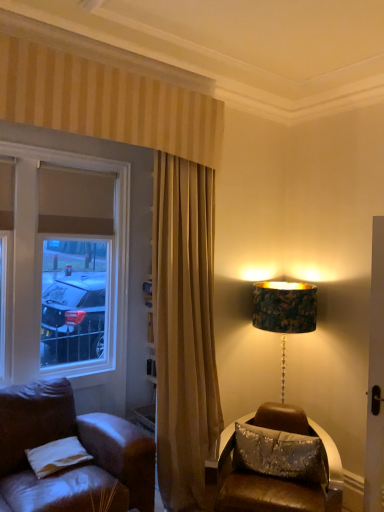
Question: From a real-world perspective, is white fabric pillow at lower left, the 2th pillow in the right-to-left sequence, below matte glass window at left?

Choices:
 (A) yes
 (B) no

Answer: (A)

Question: Is white fabric pillow at lower left, arranged as the first pillow when viewed from the left, with matte glass window at left?

Choices:
 (A) yes
 (B) no

Answer: (B)

Question: From the image's perspective, is white fabric pillow at lower left, the 2th pillow in the right-to-left sequence, on top of matte glass window at left?

Choices:
 (A) yes
 (B) no

Answer: (B)

Question: Could you tell me if white fabric pillow at lower left, arranged as the first pillow when viewed from the left, is facing matte glass window at left?

Choices:
 (A) yes
 (B) no

Answer: (B)

Question: Considering the relative positions of white fabric pillow at lower left, the 2th pillow in the right-to-left sequence, and matte glass window at left in the image provided, is white fabric pillow at lower left, the 2th pillow in the right-to-left sequence, to the left of matte glass window at left from the viewer's perspective?

Choices:
 (A) yes
 (B) no

Answer: (B)

Question: Can you confirm if white fabric pillow at lower left, the 2th pillow in the right-to-left sequence, is taller than matte glass window at left?

Choices:
 (A) yes
 (B) no

Answer: (B)

Question: Is matte glass window at left not close to white fabric pillow at lower left, the 2th pillow in the right-to-left sequence?

Choices:
 (A) no
 (B) yes

Answer: (B)

Question: Is matte glass window at left not inside white fabric pillow at lower left, the 2th pillow in the right-to-left sequence?

Choices:
 (A) yes
 (B) no

Answer: (A)

Question: Considering the relative sizes of matte glass window at left and white fabric pillow at lower left, the 2th pillow in the right-to-left sequence, in the image provided, is matte glass window at left bigger than white fabric pillow at lower left, the 2th pillow in the right-to-left sequence,?

Choices:
 (A) yes
 (B) no

Answer: (A)

Question: Considering the relative positions of matte glass window at left and white fabric pillow at lower left, the 2th pillow in the right-to-left sequence, in the image provided, is matte glass window at left to the right of white fabric pillow at lower left, the 2th pillow in the right-to-left sequence, from the viewer's perspective?

Choices:
 (A) no
 (B) yes

Answer: (A)

Question: Considering the relative positions of matte glass window at left and white fabric pillow at lower left, arranged as the first pillow when viewed from the left, in the image provided, is matte glass window at left to the left of white fabric pillow at lower left, arranged as the first pillow when viewed from the left, from the viewer's perspective?

Choices:
 (A) yes
 (B) no

Answer: (A)

Question: From the image's perspective, is matte glass window at left below white fabric pillow at lower left, the 2th pillow in the right-to-left sequence?

Choices:
 (A) yes
 (B) no

Answer: (B)

Question: Can you confirm if white fabric pillow at lower left, arranged as the first pillow when viewed from the left, is smaller than sparkly silver pillow at lower right, the second pillow positioned from the left?

Choices:
 (A) yes
 (B) no

Answer: (A)